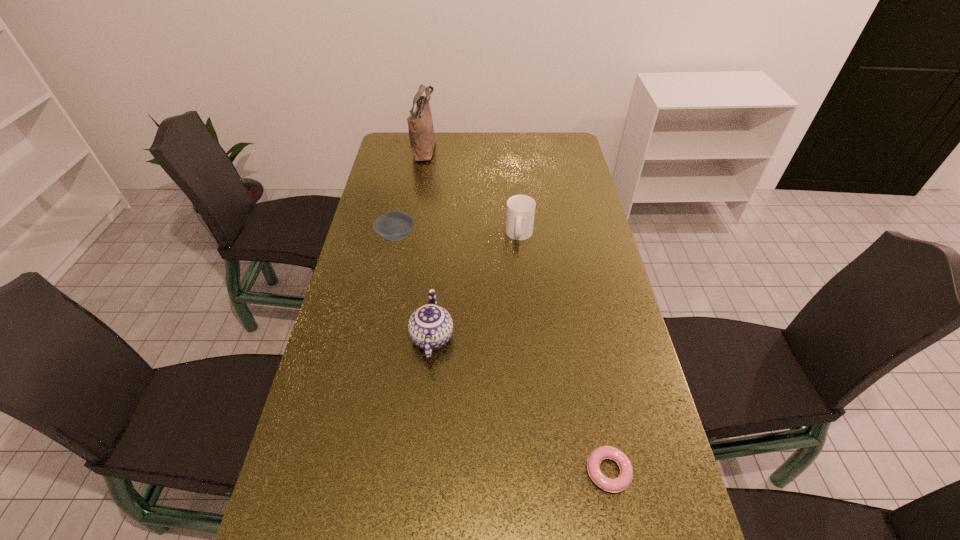
The width and height of the screenshot is (960, 540). What are the coordinates of `free space at the left edge of the desktop` in the screenshot? It's located at (361, 384).

Locate an element on the screen. vacant space at the right edge is located at coordinates (583, 190).

You are a GUI agent. You are given a task and a screenshot of the screen. Output one action in this format:
    pyautogui.click(x=<x>, y=<y>)
    Task: Click on the free space that is in between the second object from right to left and the rightmost object
    This screenshot has width=960, height=540.
    Given the screenshot: What is the action you would take?
    pyautogui.click(x=564, y=353)

What are the coordinates of `empty location between the fourth tallest object and the farthest object` in the screenshot? It's located at (411, 192).

The height and width of the screenshot is (540, 960). What are the coordinates of `free point between the tallest object and the shortest object` in the screenshot? It's located at (516, 309).

The image size is (960, 540). Identify the location of unoccupied area between the mug and the rightmost object. (564, 353).

You are a GUI agent. You are given a task and a screenshot of the screen. Output one action in this format:
    pyautogui.click(x=<x>, y=<y>)
    Task: Click on the blank region between the chinaware and the farthest object
    Image resolution: width=960 pixels, height=540 pixels.
    Given the screenshot: What is the action you would take?
    pyautogui.click(x=428, y=243)

At what (x,y) coordinates should I click in order to perform the action: click on free space between the bowl and the second object from right to left. Please return your answer as a coordinate pair (x, y). The image size is (960, 540). Looking at the image, I should click on click(x=458, y=235).

Locate an element on the screen. The image size is (960, 540). vacant space in between the mug and the fourth farthest object is located at coordinates (476, 286).

The image size is (960, 540). What are the coordinates of `free point between the farthest object and the shortest object` in the screenshot? It's located at (516, 309).